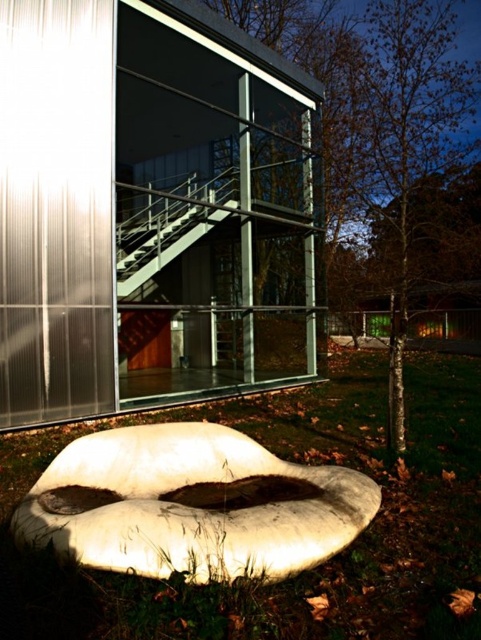
You are a landscape architect designing a garden for this building. You need to place a new bench that is 1.2 meters wide between the green grass at lower center and the metallic staircase at center. Based on the scene description, will the bench fit between them?

The green grass at lower center is wider than the metallic staircase at center. Since the bench is 1.2 meters wide, and the grass area is wider, there should be enough space to place the bench between them.

You are a maintenance worker needing to move a 5 meter long ladder from the green grass at lower center to the metallic staircase at center. Can you safely move the ladder without it hitting anything in between?

The distance between the green grass at lower center and the metallic staircase at center is 4.72 meters. Since the ladder is 5 meters long, it would not fit within the available space, so moving it might result in the ladder extending beyond the available distance, making it unsafe.

You are standing in front of the building and want to walk towards the green grass at lower center. Which direction should you move relative to the metallic staircase at center?

The green grass at lower center is to the right of the metallic staircase at center, so you should move towards the right side of the metallic staircase at center to reach it.